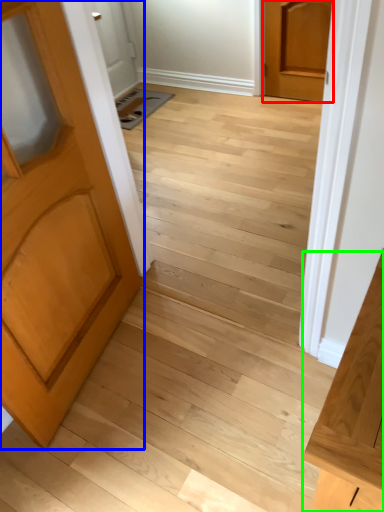
Question: Estimate the real-world distances between objects in this image. Which object is farther from door (highlighted by a red box), door (highlighted by a blue box) or vanity (highlighted by a green box)?

Choices:
 (A) door
 (B) vanity

Answer: (B)